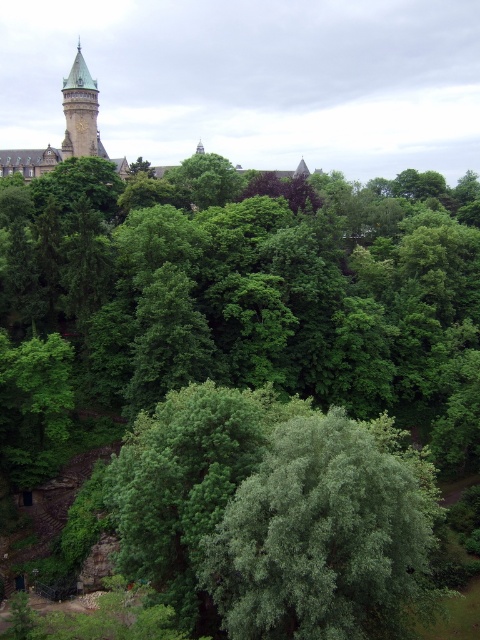
Question: Estimate the real-world distances between objects in this image. Which object is farther from the green stone tower at upper left?

Choices:
 (A) stone tower at upper left
 (B) green leafy tree at center

Answer: (B)

Question: Is green leafy tree at center smaller than stone tower at upper left?

Choices:
 (A) no
 (B) yes

Answer: (B)

Question: Is green leafy tree at center behind green stone tower at upper left?

Choices:
 (A) no
 (B) yes

Answer: (A)

Question: Among these points, which one is nearest to the camera?

Choices:
 (A) (82, 144)
 (B) (88, 132)
 (C) (274, 636)

Answer: (C)

Question: Which point is closer to the camera?

Choices:
 (A) (310, 477)
 (B) (76, 83)
 (C) (1, 156)

Answer: (A)

Question: Can you confirm if stone tower at upper left is positioned above green stone tower at upper left?

Choices:
 (A) yes
 (B) no

Answer: (A)